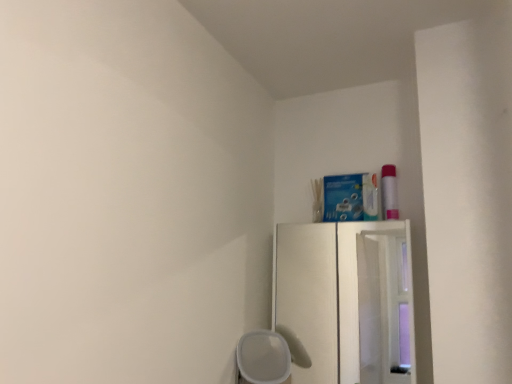
I want to click on white wood cabinet at upper right, so click(345, 300).

Describe the element at coordinates (345, 300) in the screenshot. The height and width of the screenshot is (384, 512). I see `white wood cabinet at upper right` at that location.

Find the location of a particular element. white matte cup at lower center is located at coordinates (262, 358).

What do you see at coordinates (262, 358) in the screenshot? Image resolution: width=512 pixels, height=384 pixels. I see `white matte cup at lower center` at bounding box center [262, 358].

The width and height of the screenshot is (512, 384). Find the location of `white wood cabinet at upper right`. white wood cabinet at upper right is located at coordinates (345, 300).

Is white wood cabinet at upper right to the left of white matte cup at lower center from the viewer's perspective?

Incorrect, white wood cabinet at upper right is not on the left side of white matte cup at lower center.

Which object is further away from the camera, white wood cabinet at upper right or white matte cup at lower center?

white wood cabinet at upper right is further away from the camera.

Based on the photo, which is nearer, (393, 268) or (289, 370)?

Clearly, point (393, 268) is more distant from the camera than point (289, 370).

From the image's perspective, is white wood cabinet at upper right on white matte cup at lower center?

Correct, white wood cabinet at upper right appears higher than white matte cup at lower center in the image.

From a real-world perspective, which object rests below the other?

white matte cup at lower center.

Considering the sizes of objects white wood cabinet at upper right and white matte cup at lower center in the image provided, who is wider, white wood cabinet at upper right or white matte cup at lower center?

white matte cup at lower center is wider.

Considering the sizes of objects white wood cabinet at upper right and white matte cup at lower center in the image provided, who is shorter, white wood cabinet at upper right or white matte cup at lower center?

white matte cup at lower center.

Does white wood cabinet at upper right have a larger size compared to white matte cup at lower center?

No.

Does white wood cabinet at upper right contain white matte cup at lower center?

No, white matte cup at lower center is not a part of white wood cabinet at upper right.

Is white wood cabinet at upper right beside white matte cup at lower center?

white wood cabinet at upper right and white matte cup at lower center are not in contact.

Is white matte cup at lower center at the back of white wood cabinet at upper right?

No, white wood cabinet at upper right is not facing the opposite direction of white matte cup at lower center.

Locate an element on the screen. The width and height of the screenshot is (512, 384). fridge on the right side of white matte cup at lower center is located at coordinates (345, 300).

Can you confirm if white matte cup at lower center is positioned to the right of white wood cabinet at upper right?

A: In fact, white matte cup at lower center is to the left of white wood cabinet at upper right.

Based on the photo, is the position of white matte cup at lower center less distant than that of white wood cabinet at upper right?

Yes, it is in front of white wood cabinet at upper right.

Between point (261, 382) and point (373, 227), which one is positioned behind?

Positioned behind is point (261, 382).

From the image's perspective, who appears lower, white matte cup at lower center or white wood cabinet at upper right?

From the image's view, white matte cup at lower center is below.

From a real-world perspective, between white matte cup at lower center and white wood cabinet at upper right, who is vertically lower?

white matte cup at lower center, from a real-world perspective.

Can you confirm if white matte cup at lower center is thinner than white wood cabinet at upper right?

No.

From the picture: Is white matte cup at lower center taller than white wood cabinet at upper right?

Incorrect, the height of white matte cup at lower center is not larger of that of white wood cabinet at upper right.

Can you confirm if white matte cup at lower center is bigger than white wood cabinet at upper right?

Yes, white matte cup at lower center is bigger than white wood cabinet at upper right.

Is white matte cup at lower center not within white wood cabinet at upper right?

Yes, white matte cup at lower center is outside of white wood cabinet at upper right.

Is white matte cup at lower center touching white wood cabinet at upper right?

white matte cup at lower center and white wood cabinet at upper right are clearly separated.

Is white matte cup at lower center facing towards white wood cabinet at upper right?

No, white matte cup at lower center does not turn towards white wood cabinet at upper right.

How many degrees apart are the facing directions of white matte cup at lower center and white wood cabinet at upper right?

The facing directions of white matte cup at lower center and white wood cabinet at upper right are 3.2 degrees apart.

There is a white matte cup at lower center. Where is `fridge above it (from a real-world perspective)`? Image resolution: width=512 pixels, height=384 pixels. fridge above it (from a real-world perspective) is located at coordinates (345, 300).

Locate an element on the screen. fridge lying behind the white matte cup at lower center is located at coordinates [345, 300].

The width and height of the screenshot is (512, 384). I want to click on furniture located on the left of white wood cabinet at upper right, so click(262, 358).